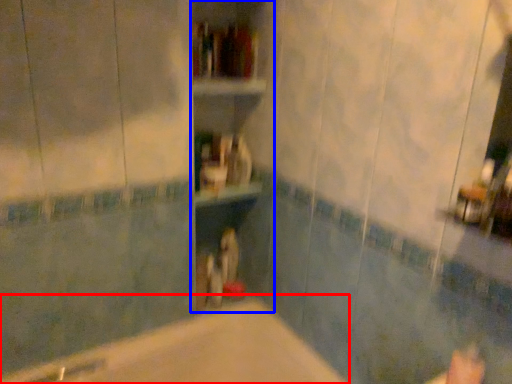
Question: Which object is further to the camera taking this photo, bathtub (highlighted by a red box) or bookshelf (highlighted by a blue box)?

Choices:
 (A) bathtub
 (B) bookshelf

Answer: (B)